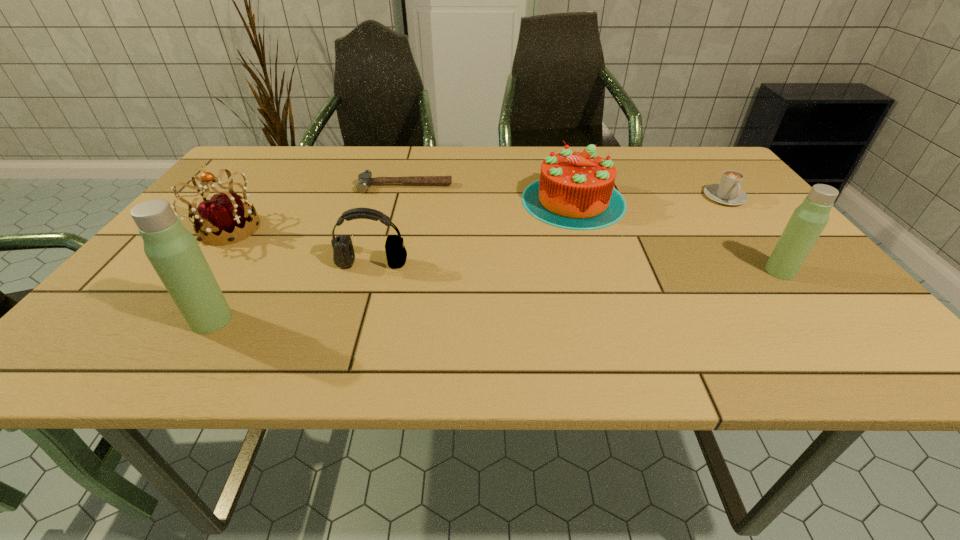
Identify the location of the nearer thermos bottle. (173, 251).

In order to click on the left thermos bottle in this screenshot , I will do `click(173, 251)`.

I want to click on the right thermos bottle, so click(x=809, y=219).

This screenshot has height=540, width=960. I want to click on the farther thermos bottle, so click(x=809, y=219).

Find the location of a particular element. the sixth tallest object is located at coordinates (728, 192).

The height and width of the screenshot is (540, 960). Find the location of `the shortest object`. the shortest object is located at coordinates (365, 179).

This screenshot has height=540, width=960. Identify the location of cake. (575, 190).

Identify the location of tiara. The height and width of the screenshot is (540, 960). click(226, 219).

Where is `headset`? The height and width of the screenshot is (540, 960). headset is located at coordinates (343, 252).

Find the location of a particular element. The width and height of the screenshot is (960, 540). free spot located on the back of the nearest object is located at coordinates (250, 259).